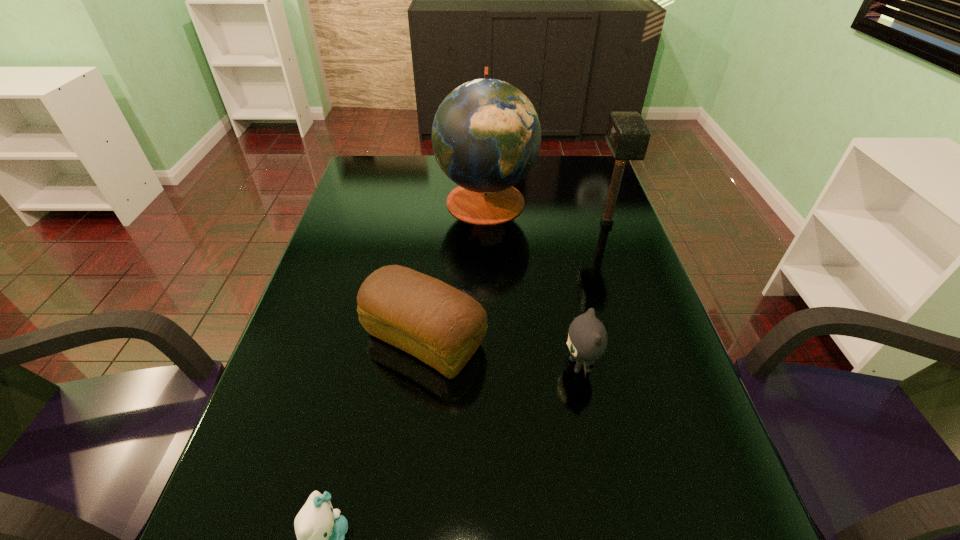
The width and height of the screenshot is (960, 540). I want to click on free space that satisfies the following two spatial constraints: 1. with the Americas facing the viewer on the tallest object; 2. on the back side of the mallet, so click(x=486, y=223).